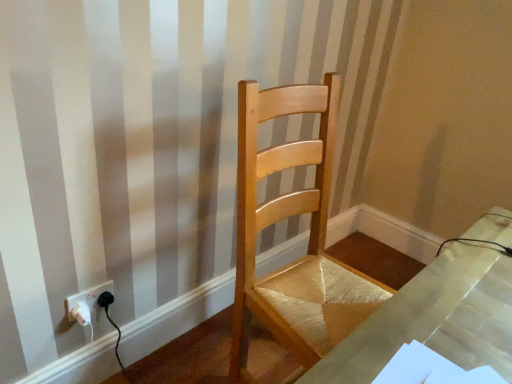
Question: Is white plastic socket at lower left outside of natural wood chair at center?

Choices:
 (A) no
 (B) yes

Answer: (B)

Question: From a real-world perspective, does white plastic socket at lower left stand above natural wood chair at center?

Choices:
 (A) no
 (B) yes

Answer: (A)

Question: Is white plastic socket at lower left to the right of natural wood chair at center from the viewer's perspective?

Choices:
 (A) no
 (B) yes

Answer: (A)

Question: Can you confirm if white plastic socket at lower left is shorter than natural wood chair at center?

Choices:
 (A) no
 (B) yes

Answer: (B)

Question: Can you confirm if white plastic socket at lower left is smaller than natural wood chair at center?

Choices:
 (A) yes
 (B) no

Answer: (A)

Question: Considering the relative positions of white plastic socket at lower left and natural wood chair at center in the image provided, is white plastic socket at lower left in front of natural wood chair at center?

Choices:
 (A) no
 (B) yes

Answer: (A)

Question: Considering the relative positions of natural wood chair at center and white plastic socket at lower left in the image provided, is natural wood chair at center to the left of white plastic socket at lower left from the viewer's perspective?

Choices:
 (A) no
 (B) yes

Answer: (A)

Question: Is natural wood chair at center not within white plastic socket at lower left?

Choices:
 (A) no
 (B) yes

Answer: (B)

Question: Considering the relative sizes of natural wood chair at center and white plastic socket at lower left in the image provided, is natural wood chair at center bigger than white plastic socket at lower left?

Choices:
 (A) yes
 (B) no

Answer: (A)

Question: Does natural wood chair at center have a lesser width compared to white plastic socket at lower left?

Choices:
 (A) no
 (B) yes

Answer: (A)

Question: Is white plastic socket at lower left a part of natural wood chair at center?

Choices:
 (A) no
 (B) yes

Answer: (A)

Question: Is natural wood chair at center positioned behind white plastic socket at lower left?

Choices:
 (A) yes
 (B) no

Answer: (B)

Question: Considering the positions of point pyautogui.click(x=109, y=284) and point pyautogui.click(x=241, y=157), is point pyautogui.click(x=109, y=284) closer or farther from the camera than point pyautogui.click(x=241, y=157)?

Choices:
 (A) closer
 (B) farther

Answer: (B)